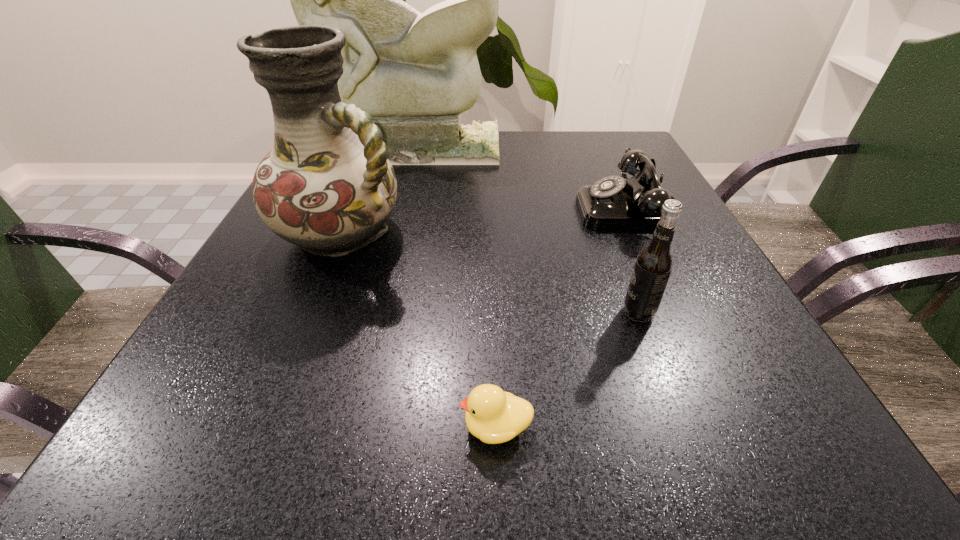
Locate an element on the screen. The width and height of the screenshot is (960, 540). sculpture situated at the left edge is located at coordinates (414, 73).

Where is `vase present at the left edge`? vase present at the left edge is located at coordinates (327, 185).

Locate an element on the screen. This screenshot has height=540, width=960. root beer situated at the right edge is located at coordinates (654, 263).

At what (x,y) coordinates should I click in order to perform the action: click on telephone that is at the right edge. Please return your answer as a coordinate pair (x, y). The image size is (960, 540). Looking at the image, I should click on pos(614,202).

This screenshot has width=960, height=540. Find the location of `object present at the far left corner`. object present at the far left corner is located at coordinates (414, 73).

Where is `free space at the far edge of the desktop`? Image resolution: width=960 pixels, height=540 pixels. free space at the far edge of the desktop is located at coordinates (543, 133).

The height and width of the screenshot is (540, 960). I want to click on vacant area at the near edge of the desktop, so click(434, 433).

Where is `vacant point at the left edge`? This screenshot has height=540, width=960. vacant point at the left edge is located at coordinates (255, 272).

Identify the location of blank space at the right edge of the desktop. (713, 276).

Find the location of a particular element. vacant region at the near left corner of the desktop is located at coordinates (148, 461).